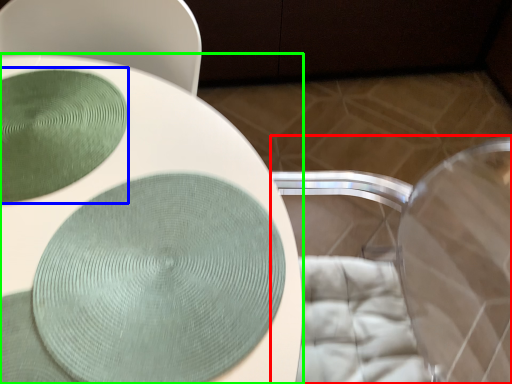
Question: Estimate the real-world distances between objects in this image. Which object is farther from swivel chair (highlighted by a red box), glass plate (highlighted by a blue box) or toilet (highlighted by a green box)?

Choices:
 (A) glass plate
 (B) toilet

Answer: (A)